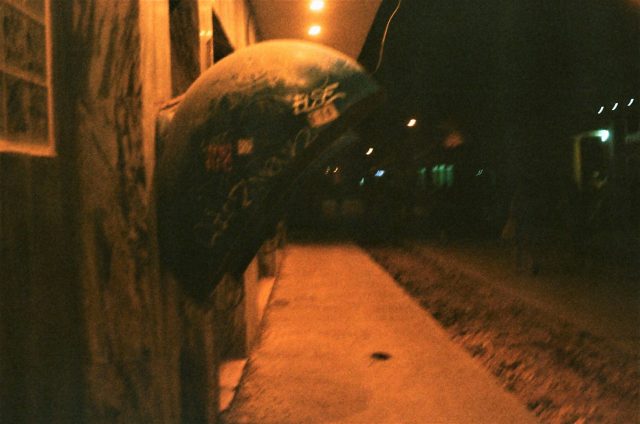
Locate an element on the screen. The image size is (640, 424). doorways is located at coordinates (225, 330), (264, 263).